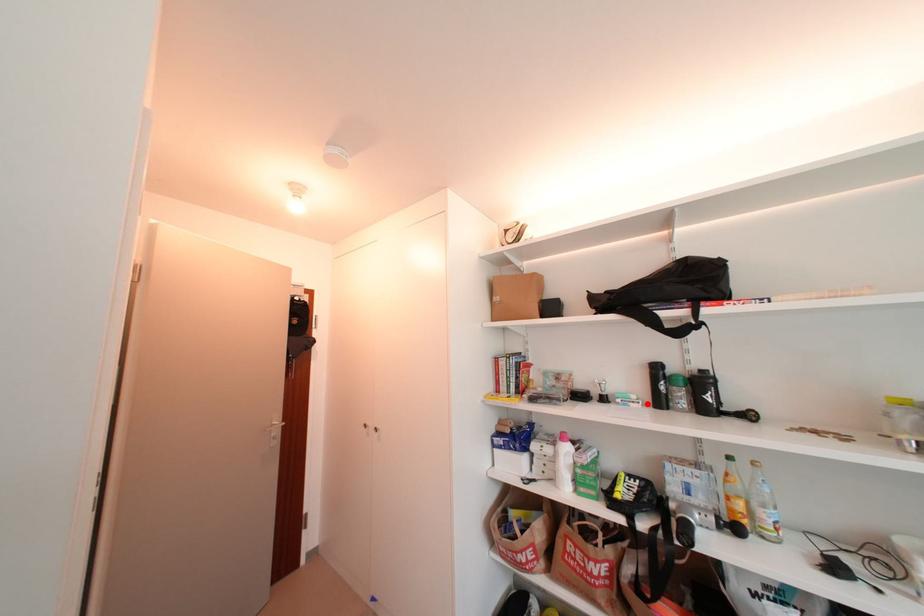
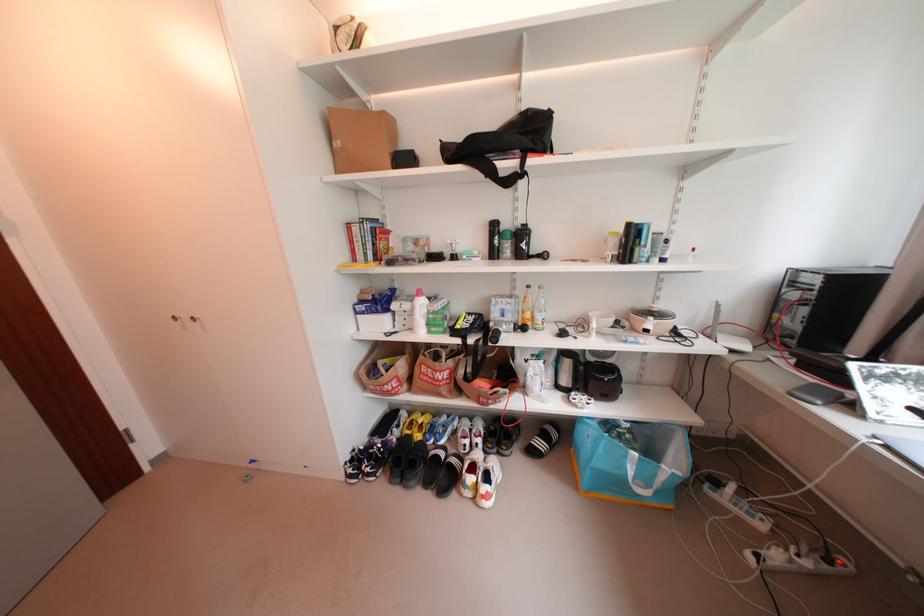
The point at the highlighted location is marked in the first image. Where is the corresponding point in the second image?

(488, 257)